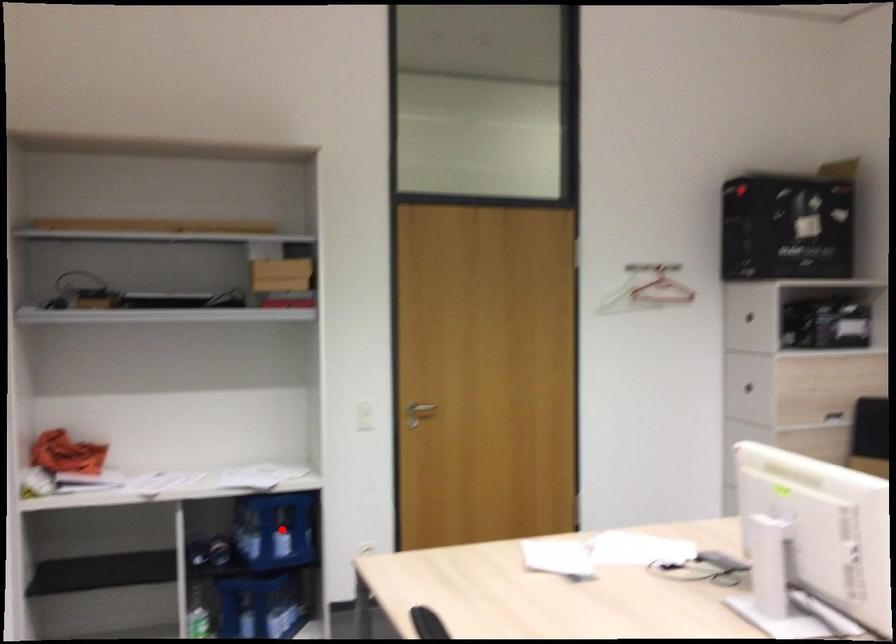
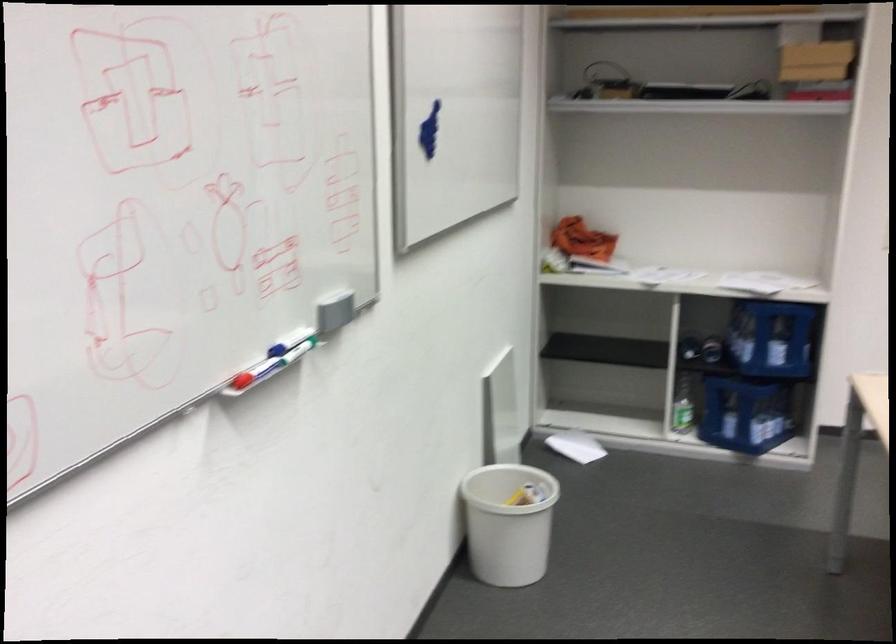
Question: I am providing you with two images of the same scene from different viewpoints. A red point is marked on the first image. Can you still see the location of the red point in image 2?

Choices:
 (A) Yes
 (B) No

Answer: (A)